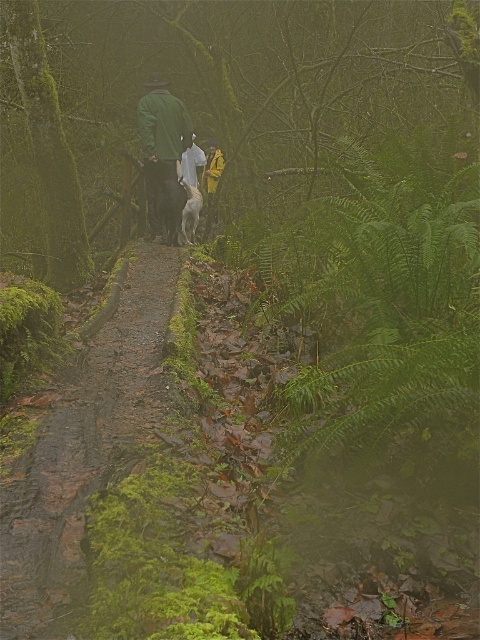
Is green wool jacket at center bigger than yellow waterproof jacket at center?

Indeed, green wool jacket at center has a larger size compared to yellow waterproof jacket at center.

Who is higher up, green wool jacket at center or yellow waterproof jacket at center?

Positioned higher is yellow waterproof jacket at center.

Does point (182, 160) lie in front of point (204, 180)?

Yes, point (182, 160) is closer to viewer.

Locate an element on the screen. Image resolution: width=480 pixels, height=640 pixels. green wool jacket at center is located at coordinates (192, 163).

Can you confirm if white fur dog at center is positioned above green wool jacket at center?

No.

Who is lower down, white fur dog at center or green wool jacket at center?

Positioned lower is white fur dog at center.

Where is `white fur dog at center`? This screenshot has width=480, height=640. white fur dog at center is located at coordinates (190, 211).

Does point (172, 220) lie behind point (197, 173)?

No, (172, 220) is closer to viewer.

Which is above, green matte jacket at center or green wool jacket at center?

green wool jacket at center

I want to click on green matte jacket at center, so click(163, 154).